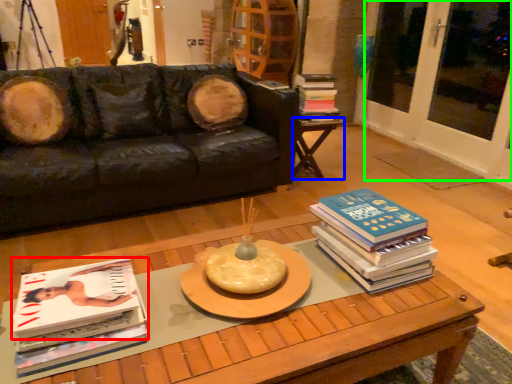
Question: Considering the real-world distances, which object is farthest from book (highlighted by a red box)? table (highlighted by a blue box) or screen door (highlighted by a green box)?

Choices:
 (A) table
 (B) screen door

Answer: (B)